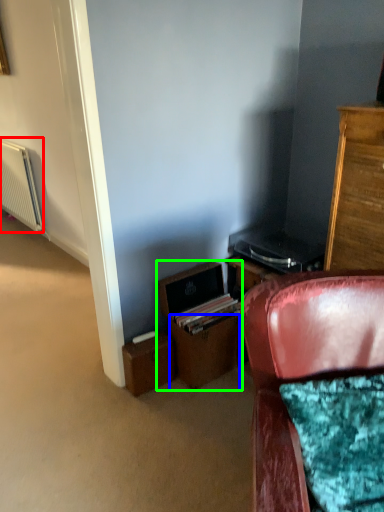
Question: Which is farther away from radiator (highlighted by a red box)? drawer (highlighted by a blue box) or file cabinet (highlighted by a green box)?

Choices:
 (A) drawer
 (B) file cabinet

Answer: (A)